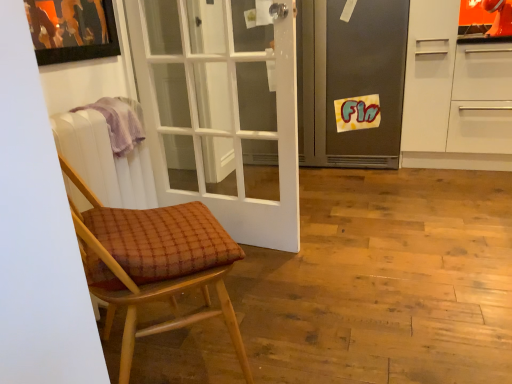
Question: Would you say brown woven cushion at left is to the left or to the right of purple cloth at left in the picture?

Choices:
 (A) right
 (B) left

Answer: (A)

Question: Is brown woven cushion at left situated inside purple cloth at left or outside?

Choices:
 (A) outside
 (B) inside

Answer: (A)

Question: Estimate the real-world distances between objects in this image. Which object is farther from the metallic gray refrigerator at center?

Choices:
 (A) white plastic radiator at left
 (B) brown woven cushion at left
 (C) purple cloth at left

Answer: (B)

Question: Estimate the real-world distances between objects in this image. Which object is closer to the purple cloth at left?

Choices:
 (A) brown woven cushion at left
 (B) metallic gray refrigerator at center
 (C) white plastic radiator at left

Answer: (C)